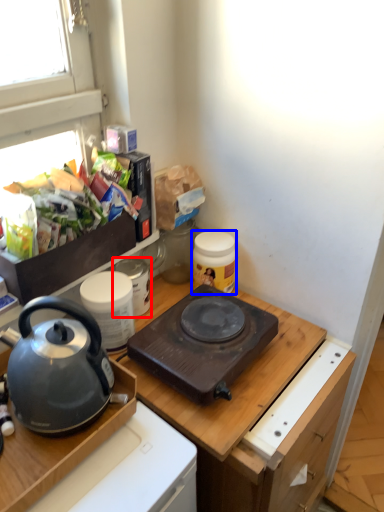
Question: Which point is further to the camera, appliance (highlighted by a red box) or kitchen appliance (highlighted by a blue box)?

Choices:
 (A) appliance
 (B) kitchen appliance

Answer: (B)